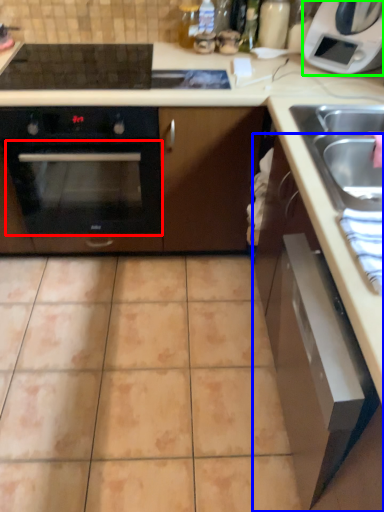
Question: Estimate the real-world distances between objects in this image. Which object is farther from oven (highlighted by a red box), cabinetry (highlighted by a blue box) or home appliance (highlighted by a green box)?

Choices:
 (A) cabinetry
 (B) home appliance

Answer: (B)